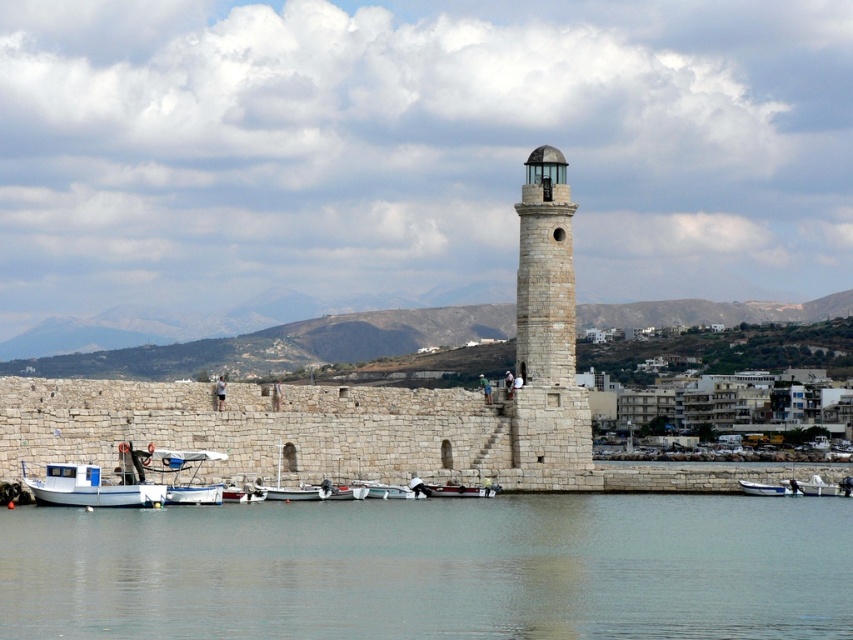
Question: Among these points, which one is farthest from the camera?

Choices:
 (A) (815, 496)
 (B) (778, 493)
 (C) (448, 493)
 (D) (338, 422)

Answer: (A)

Question: Does stone at center have a larger size compared to white wooden boat at center?

Choices:
 (A) no
 (B) yes

Answer: (B)

Question: Among these points, which one is farthest from the camera?

Choices:
 (A) (461, 496)
 (B) (409, 492)
 (C) (100, 506)
 (D) (316, 589)

Answer: (A)

Question: Does stone lighthouse at center have a greater width compared to white wooden boat at center?

Choices:
 (A) yes
 (B) no

Answer: (A)

Question: Can you confirm if stone at center is positioned to the left of white matte boat at center?

Choices:
 (A) yes
 (B) no

Answer: (A)

Question: Which of the following is the farthest from the observer?

Choices:
 (A) white matte boat at lower right
 (B) white wooden boat at center
 (C) stone lighthouse at center
 (D) white matte boat at center

Answer: (A)